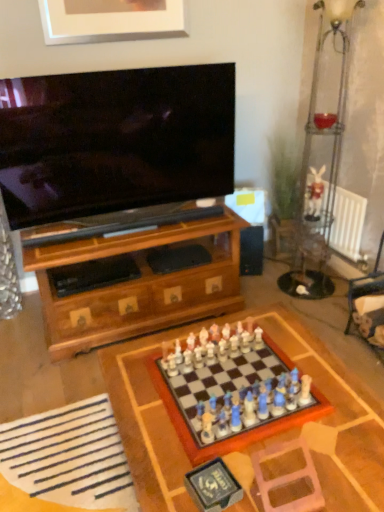
Question: From a real-world perspective, is brushed silver picture frame at upper center on top of wooden chessboard at center?

Choices:
 (A) yes
 (B) no

Answer: (A)

Question: Is brushed silver picture frame at upper center wider than wooden chessboard at center?

Choices:
 (A) yes
 (B) no

Answer: (B)

Question: From a real-world perspective, is brushed silver picture frame at upper center under wooden chessboard at center?

Choices:
 (A) no
 (B) yes

Answer: (A)

Question: Is wooden chessboard at center completely or partially inside brushed silver picture frame at upper center?

Choices:
 (A) yes
 (B) no

Answer: (B)

Question: From the image's perspective, is brushed silver picture frame at upper center under wooden chessboard at center?

Choices:
 (A) yes
 (B) no

Answer: (B)

Question: Which is correct: white fabric at lower left is inside white fabric swivel chair at lower right, the 2th swivel chair from the front, or outside of it?

Choices:
 (A) inside
 (B) outside

Answer: (B)

Question: Based on their sizes in the image, would you say white fabric at lower left is bigger or smaller than white fabric swivel chair at lower right, the 1th swivel chair in the back-to-front sequence?

Choices:
 (A) big
 (B) small

Answer: (B)

Question: Is white fabric at lower left taller or shorter than white fabric swivel chair at lower right, the 1th swivel chair from the top?

Choices:
 (A) short
 (B) tall

Answer: (A)

Question: Visually, is white fabric at lower left positioned to the left or to the right of white fabric swivel chair at lower right, which is the 2th swivel chair from bottom to top?

Choices:
 (A) right
 (B) left

Answer: (B)

Question: Is white metallic radiator at right bigger or smaller than white fabric swivel chair at lower right, which appears as the second swivel chair when viewed from the left?

Choices:
 (A) big
 (B) small

Answer: (B)

Question: From their relative heights in the image, would you say white metallic radiator at right is taller or shorter than white fabric swivel chair at lower right, which is counted as the 1th swivel chair, starting from the right?

Choices:
 (A) short
 (B) tall

Answer: (A)

Question: Is white metallic radiator at right wider or thinner than white fabric swivel chair at lower right, which is the 2th swivel chair from bottom to top?

Choices:
 (A) thin
 (B) wide

Answer: (A)

Question: Is point (337, 206) positioned closer to the camera than point (357, 293)?

Choices:
 (A) farther
 (B) closer

Answer: (A)

Question: Is wooden chess set at center situated inside wooden chessboard at center or outside?

Choices:
 (A) inside
 (B) outside

Answer: (A)

Question: Looking at the image, does wooden chess set at center seem bigger or smaller compared to wooden chessboard at center?

Choices:
 (A) small
 (B) big

Answer: (A)